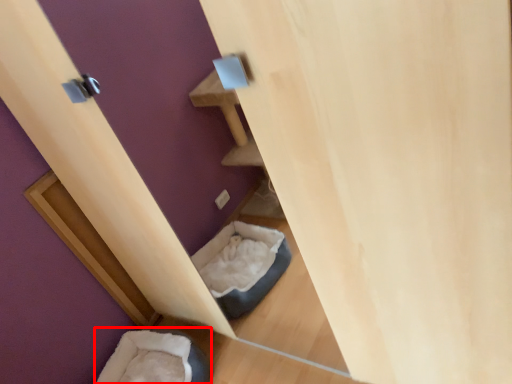
Question: Where is bean bag chair (annotated by the red box) located in relation to wood in the image?

Choices:
 (A) right
 (B) left

Answer: (A)